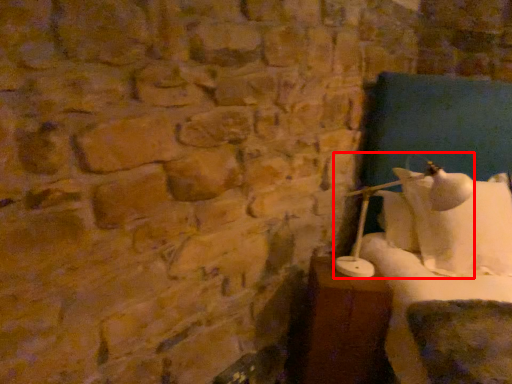
Question: From the image's perspective, where is table lamp (annotated by the red box) located in relation to furniture in the image?

Choices:
 (A) below
 (B) above

Answer: (B)